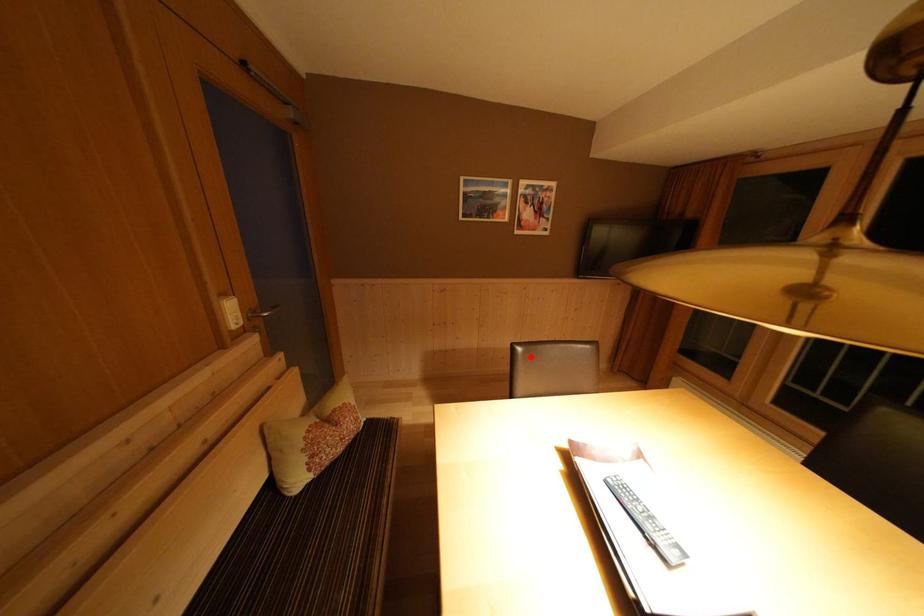
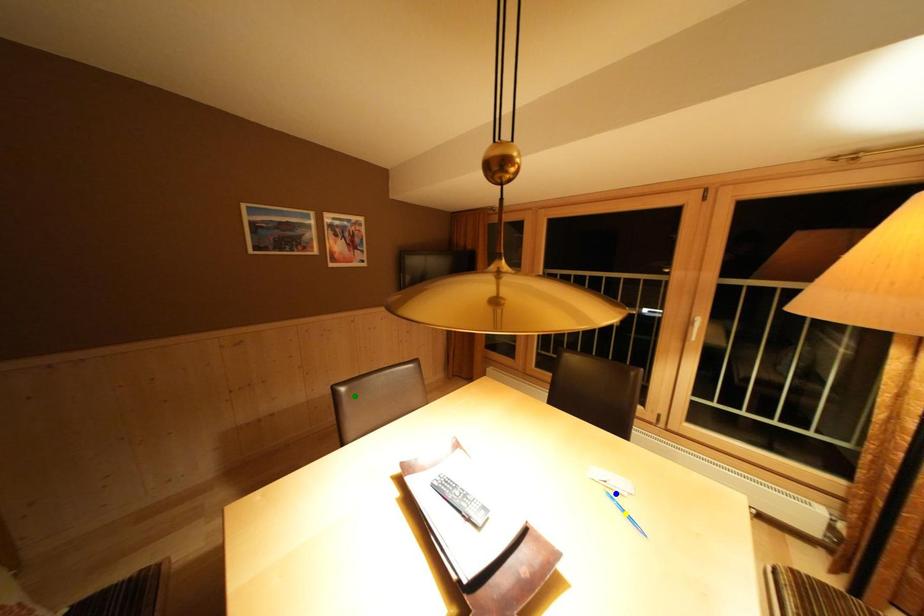
Question: I am providing you with two images of the same scene from different viewpoints. A red point is marked on the first image. You are given multiple points on the second image. Which mark in image 2 goes with the point in image 1?

Choices:
 (A) blue point
 (B) green point
 (C) yellow point

Answer: (B)